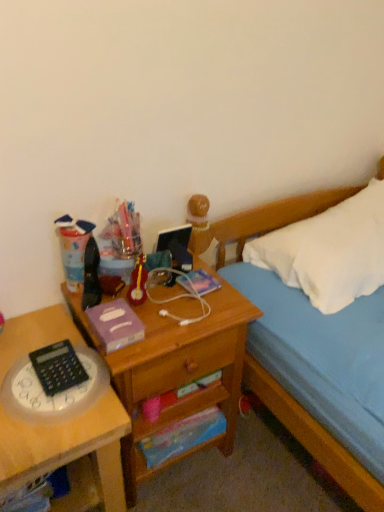
Where is `white soft pillow at upper right`? This screenshot has height=512, width=384. white soft pillow at upper right is located at coordinates (329, 251).

What is the approximate height of metallic purple paperback book at center, acting as the third paperback book starting from the bottom?

metallic purple paperback book at center, acting as the third paperback book starting from the bottom, is 0.69 inches in height.

What is the approximate width of white soft bed at upper right?

It is 35.54 inches.

Identify the location of white soft bed at upper right. The height and width of the screenshot is (512, 384). (314, 438).

Locate an element on the screen. translucent plastic clock at lower left is located at coordinates (55, 394).

The height and width of the screenshot is (512, 384). Identify the location of matte plastic cup at left. click(73, 248).

Between wooden drawer at center and wooden desk at center, the 2th desk in the left-to-right sequence, which one is positioned in front?

wooden desk at center, the 2th desk in the left-to-right sequence.

Is wooden drawer at center wider or thinner than wooden desk at center, the 2th desk in the left-to-right sequence?

Considering their sizes, wooden drawer at center looks slimmer than wooden desk at center, the 2th desk in the left-to-right sequence.

Which is correct: wooden drawer at center is inside wooden desk at center, the 2th desk in the left-to-right sequence, or outside of it?

wooden drawer at center is contained in wooden desk at center, the 2th desk in the left-to-right sequence.

Does wooden drawer at center touch wooden desk at center, arranged as the 1th desk when viewed from the right?

Yes.

Can you confirm if wooden drawer at center is wider than purple matte paper at center, placed as the second paperback book when sorted from bottom to top?

Yes, wooden drawer at center is wider than purple matte paper at center, placed as the second paperback book when sorted from bottom to top.

Does wooden drawer at center have a lesser height compared to purple matte paper at center, which is the second paperback book from top to bottom?

No.

From a real-world perspective, is wooden drawer at center below purple matte paper at center, placed as the second paperback book when sorted from bottom to top?

Yes, from a real-world perspective, wooden drawer at center is below purple matte paper at center, placed as the second paperback book when sorted from bottom to top.

Is purple matte paper at center, placed as the second paperback book when sorted from bottom to top, a part of blue paper at lower center, placed as the first paperback book when sorted from bottom to top?

Definitely not — purple matte paper at center, placed as the second paperback book when sorted from bottom to top, is not inside blue paper at lower center, placed as the first paperback book when sorted from bottom to top.

Which paperback book is the 2nd one when counting from the back of the purple matte paper at center, the 1th paperback book positioned from the front? Please provide its 2D coordinates.

[(182, 436)]

Between blue paper at lower center, the 3th paperback book viewed from the top, and purple matte paper at center, the 1th paperback book positioned from the front, which one has more height?

blue paper at lower center, the 3th paperback book viewed from the top, is taller.

Does point (154, 446) come farther from viewer compared to point (129, 307)?

That is True.

Based on the photo, considering the relative sizes of metallic purple paperback book at center, acting as the third paperback book starting from the bottom, and white soft pillow at upper right in the image provided, is metallic purple paperback book at center, acting as the third paperback book starting from the bottom, taller than white soft pillow at upper right?

Incorrect, the height of metallic purple paperback book at center, acting as the third paperback book starting from the bottom, is not larger of that of white soft pillow at upper right.

From a real-world perspective, which is physically above, metallic purple paperback book at center, acting as the third paperback book starting from the bottom, or white soft pillow at upper right?

white soft pillow at upper right.

Is metallic purple paperback book at center, the 2th paperback book viewed from the front, positioned before white soft pillow at upper right?

No, it is not.

Is metallic purple paperback book at center, acting as the third paperback book starting from the bottom, aimed at white soft pillow at upper right?

No, metallic purple paperback book at center, acting as the third paperback book starting from the bottom, is not facing towards white soft pillow at upper right.

Does point (89, 393) appear closer or farther from the camera than point (145, 379)?

Clearly, point (89, 393) is closer to the camera than point (145, 379).

From the image's perspective, is translucent plastic clock at lower left positioned above or below wooden drawer at center?

From the image's perspective, translucent plastic clock at lower left appears above wooden drawer at center.

Can you confirm if translucent plastic clock at lower left is bigger than wooden drawer at center?

No.

Which object is closer to the camera taking this photo, blue paper at lower center, the 3th paperback book viewed from the top, or white soft pillow at upper right?

white soft pillow at upper right.

Which is in front, point (140, 444) or point (317, 269)?

The point (140, 444) is closer to the camera.

Is blue paper at lower center, the 3th paperback book viewed from the top, beside white soft pillow at upper right?

There is a gap between blue paper at lower center, the 3th paperback book viewed from the top, and white soft pillow at upper right.

From the image's perspective, is blue paper at lower center, which is the 1th paperback book from back to front, positioned above or below white soft pillow at upper right?

blue paper at lower center, which is the 1th paperback book from back to front, is below white soft pillow at upper right.

I want to click on desk on the left side of wooden desk at center, arranged as the 1th desk when viewed from the right, so click(60, 422).

Is translucent plastic clock at left, which appears as the 2th desk when viewed from the right, located within wooden desk at center, arranged as the 1th desk when viewed from the right?

No, translucent plastic clock at left, which appears as the 2th desk when viewed from the right, is located outside of wooden desk at center, arranged as the 1th desk when viewed from the right.

Is wooden desk at center, the 2th desk in the left-to-right sequence, oriented away from translucent plastic clock at left, which appears as the 2th desk when viewed from the right?

No, translucent plastic clock at left, which appears as the 2th desk when viewed from the right, is not at the back of wooden desk at center, the 2th desk in the left-to-right sequence.

Which is in front, wooden desk at center, the 2th desk in the left-to-right sequence, or translucent plastic clock at left, which appears as the 2th desk when viewed from the right?

translucent plastic clock at left, which appears as the 2th desk when viewed from the right, is closer to the camera.

I want to click on the 1st desk in front when counting from the wooden drawer at center, so click(x=175, y=371).

Where is `paperback book on the left of the wooden drawer at center`? The height and width of the screenshot is (512, 384). paperback book on the left of the wooden drawer at center is located at coordinates (115, 324).

Based on their spatial positions, is matte plastic cup at left or blue paper at lower center, the third paperback book viewed from the front, closer to metallic purple paperback book at center, the first paperback book in the top-to-bottom sequence?

The object closer to metallic purple paperback book at center, the first paperback book in the top-to-bottom sequence, is matte plastic cup at left.

From the picture: Which object lies further to the anchor point wooden desk at center, arranged as the 1th desk when viewed from the right, purple matte paper at center, placed as the second paperback book when sorted from bottom to top, or white soft bed at upper right?

white soft bed at upper right.

When comparing their distances from white soft pillow at upper right, does translucent plastic clock at left, which appears as the 2th desk when viewed from the right, or blue paper at lower center, placed as the first paperback book when sorted from bottom to top, seem further?

translucent plastic clock at left, which appears as the 2th desk when viewed from the right, lies further to white soft pillow at upper right than the other object.

Which object lies nearer to the anchor point wooden drawer at center, blue paper at lower center, which is the 1th paperback book from back to front, or purple matte paper at center, placed as the second paperback book when sorted from bottom to top?

purple matte paper at center, placed as the second paperback book when sorted from bottom to top, is closer to wooden drawer at center.

From the image, which object appears to be farther from matte plastic cup at left, translucent plastic clock at left, the 1th desk in the left-to-right sequence, or translucent plastic clock at lower left?

translucent plastic clock at left, the 1th desk in the left-to-right sequence, is positioned further to the anchor matte plastic cup at left.

Considering their positions, is matte plastic cup at left positioned closer to purple matte paper at center, which is the second paperback book from top to bottom, than blue paper at lower center, the 3th paperback book viewed from the top?

Among the two, matte plastic cup at left is located nearer to purple matte paper at center, which is the second paperback book from top to bottom.

Based on their spatial positions, is blue paper at lower center, the third paperback book viewed from the front, or purple matte paper at center, which is the 3th paperback book from back to front, closer to translucent plastic clock at lower left?

purple matte paper at center, which is the 3th paperback book from back to front, is positioned closer to the anchor translucent plastic clock at lower left.

Which object lies nearer to the anchor point metallic purple paperback book at center, marked as the 2th paperback book in a back-to-front arrangement, wooden drawer at center or wooden desk at center, the 2th desk in the left-to-right sequence?

wooden drawer at center is closer to metallic purple paperback book at center, marked as the 2th paperback book in a back-to-front arrangement.

Locate an element on the screen. This screenshot has height=512, width=384. clock between black plastic calculator at lower left and purple matte paper at center, which is the second paperback book from top to bottom, from left to right is located at coordinates (55, 394).

This screenshot has width=384, height=512. What are the coordinates of `drawer between wooden desk at center, arranged as the 1th desk when viewed from the right, and white soft bed at upper right` in the screenshot? It's located at (188, 362).

The width and height of the screenshot is (384, 512). What are the coordinates of `drawer located between translucent plastic clock at lower left and blue paper at lower center, the 3th paperback book viewed from the top, in the depth direction` in the screenshot? It's located at (188, 362).

The width and height of the screenshot is (384, 512). In order to click on desk between translucent plastic clock at lower left and blue paper at lower center, the third paperback book viewed from the front, in the front-back direction in this screenshot , I will do `click(175, 371)`.